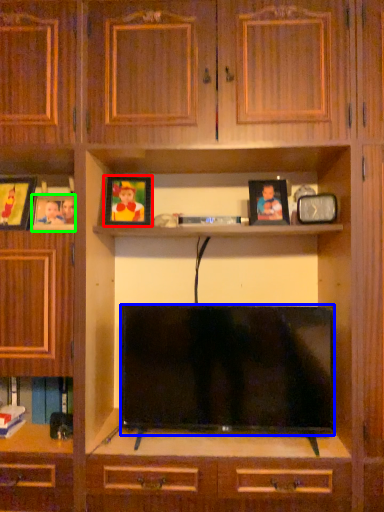
Question: Which object is the closest to the picture frame (highlighted by a red box)? Choose among these: television (highlighted by a blue box) or picture frame (highlighted by a green box).

Choices:
 (A) television
 (B) picture frame

Answer: (B)